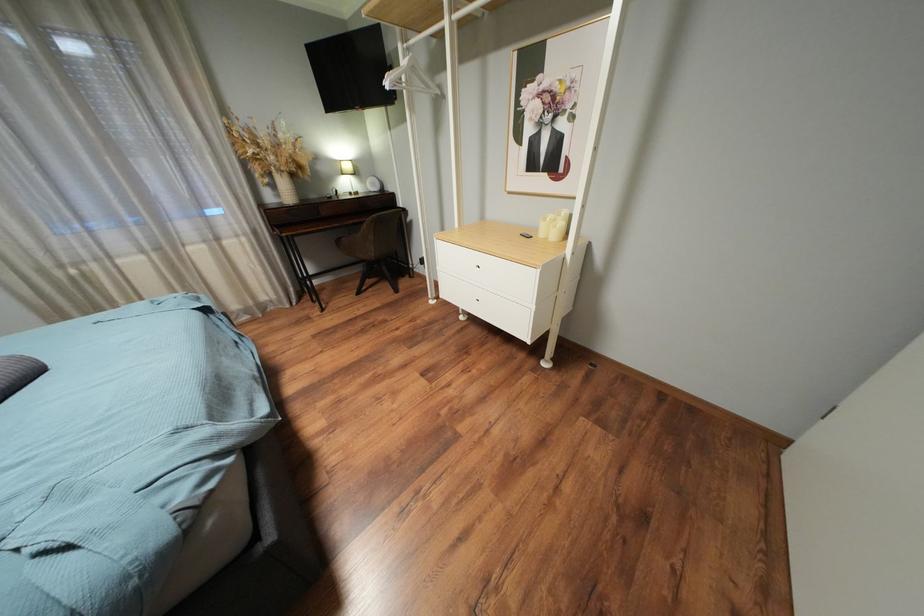
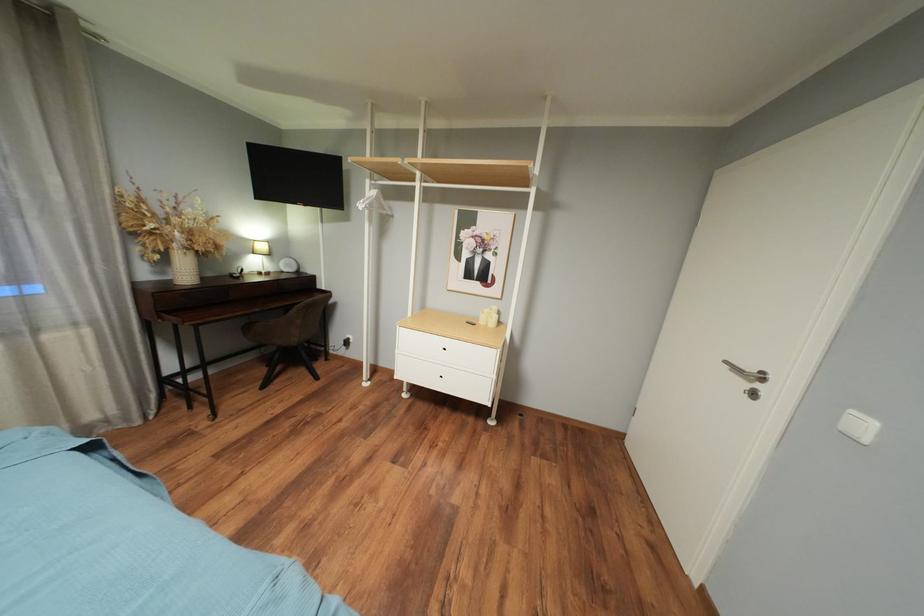
Question: The images are taken continuously from a first-person perspective. In which direction is your viewpoint rotating?

Choices:
 (A) Left
 (B) Right
 (C) Up
 (D) Down

Answer: (B)